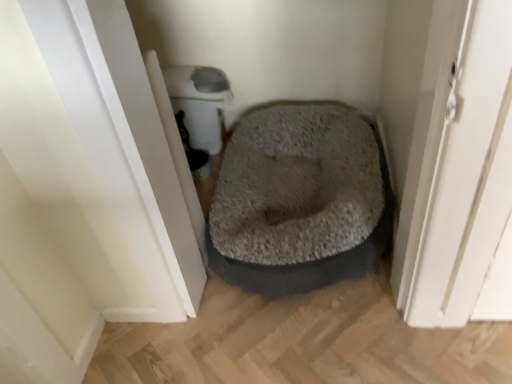
You are a GUI agent. You are given a task and a screenshot of the screen. Output one action in this format:
    pyautogui.click(x=<x>, y=<y>)
    Task: Click on the vacant area that lies in front of gray plush dog bed at center
    
    Given the screenshot: What is the action you would take?
    pyautogui.click(x=331, y=353)